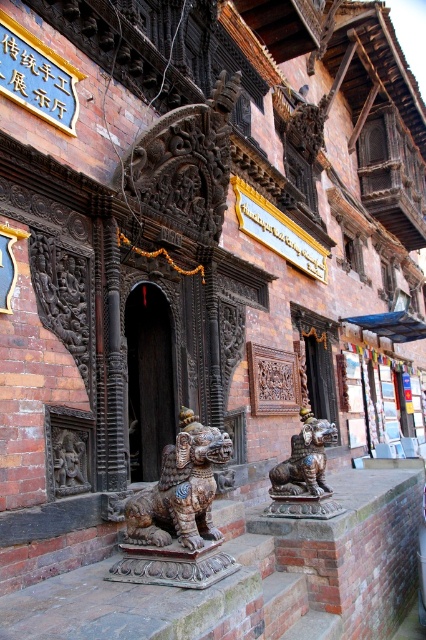
Is black wood door at center taller than dark brown stone statue at lower left?

Yes.

Is black wood door at center wider than dark brown stone statue at lower left?

Yes.

What do you see at coordinates (149, 380) in the screenshot? This screenshot has width=426, height=640. I see `black wood door at center` at bounding box center [149, 380].

What are the coordinates of `black wood door at center` in the screenshot? It's located at (149, 380).

Is bronze textured lion at center shorter than black wood door at center?

Correct, bronze textured lion at center is not as tall as black wood door at center.

Who is positioned more to the left, bronze textured lion at center or black wood door at center?

black wood door at center is more to the left.

The image size is (426, 640). Identify the location of bronze textured lion at center. (181, 490).

Does bronze textured lion at center lie in front of dark brown stone statue at lower left?

Yes, bronze textured lion at center is closer to the viewer.

Who is positioned more to the left, bronze textured lion at center or dark brown stone statue at lower left?

From the viewer's perspective, dark brown stone statue at lower left appears more on the left side.

The height and width of the screenshot is (640, 426). Describe the element at coordinates (181, 490) in the screenshot. I see `bronze textured lion at center` at that location.

Identify the location of bronze textured lion at center. (181, 490).